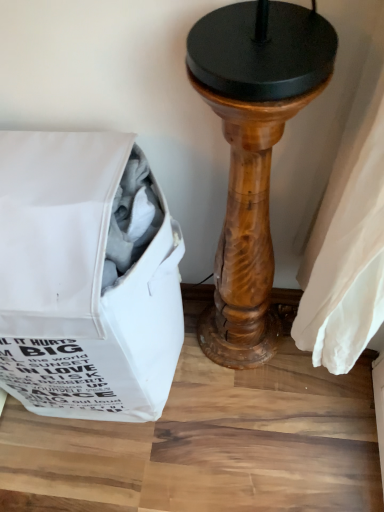
Find the location of a particular element. vacant area on top of wooden pedestal at center (from a real-world perspective) is located at coordinates (249, 44).